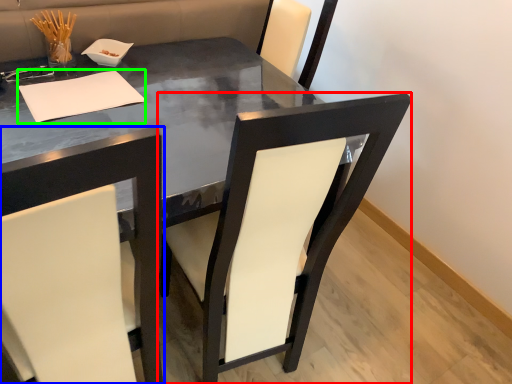
Question: Which is farther away from chair (highlighted by a red box)? chair (highlighted by a blue box) or notepad (highlighted by a green box)?

Choices:
 (A) chair
 (B) notepad

Answer: (B)